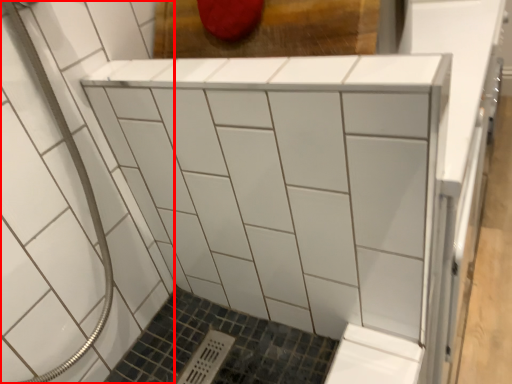
Question: From the image's perspective, what is the correct spatial relationship of bath (annotated by the red box) in relation to furniture?

Choices:
 (A) above
 (B) below

Answer: (B)